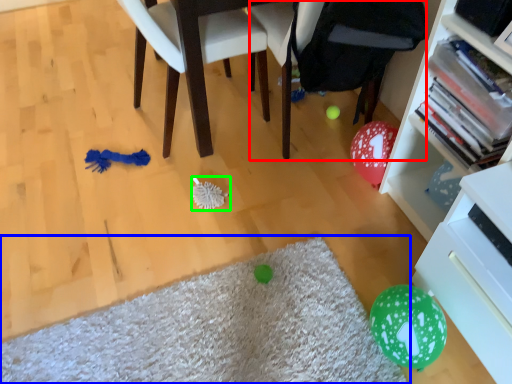
Question: Estimate the real-world distances between objects in this image. Which object is closer to bean bag chair (highlighted by a red box), mat (highlighted by a blue box) or brush (highlighted by a green box)?

Choices:
 (A) mat
 (B) brush

Answer: (B)